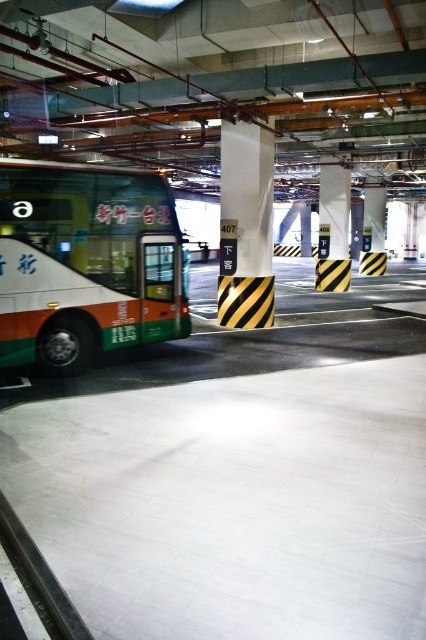
Is white glossy bus at left below yellow/black striped pillar at center?

Correct, white glossy bus at left is located below yellow/black striped pillar at center.

Does white glossy bus at left have a lesser width compared to yellow/black striped pillar at center?

No, white glossy bus at left is not thinner than yellow/black striped pillar at center.

Which is behind, point (118, 260) or point (337, 237)?

The point (337, 237) is behind.

The image size is (426, 640). In order to click on white glossy bus at left in this screenshot , I will do `click(86, 262)`.

Who is more forward, (62, 300) or (221, 134)?

Point (62, 300) is in front.

Locate an element on the screen. The width and height of the screenshot is (426, 640). white glossy bus at left is located at coordinates (86, 262).

Based on the photo, does black striped pillar at center have a lesser width compared to yellow/black striped pillar at center?

Incorrect, black striped pillar at center's width is not less than yellow/black striped pillar at center's.

Can you confirm if black striped pillar at center is bigger than yellow/black striped pillar at center?

Yes, black striped pillar at center is bigger than yellow/black striped pillar at center.

You are a GUI agent. You are given a task and a screenshot of the screen. Output one action in this format:
    pyautogui.click(x=<x>, y=<y>)
    Task: Click on the black striped pillar at center
    
    Given the screenshot: What is the action you would take?
    pyautogui.click(x=245, y=225)